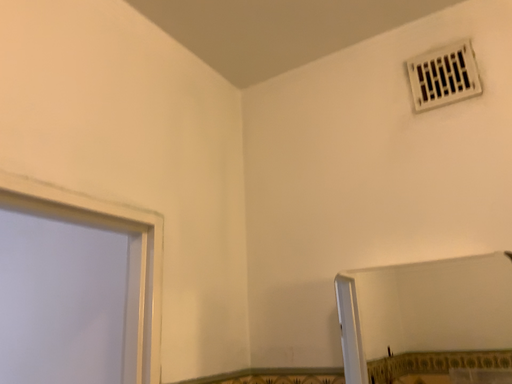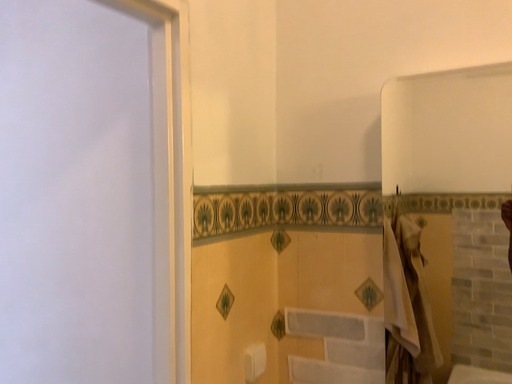
Question: Which way did the camera rotate in the video?

Choices:
 (A) rotated downward
 (B) rotated upward

Answer: (A)